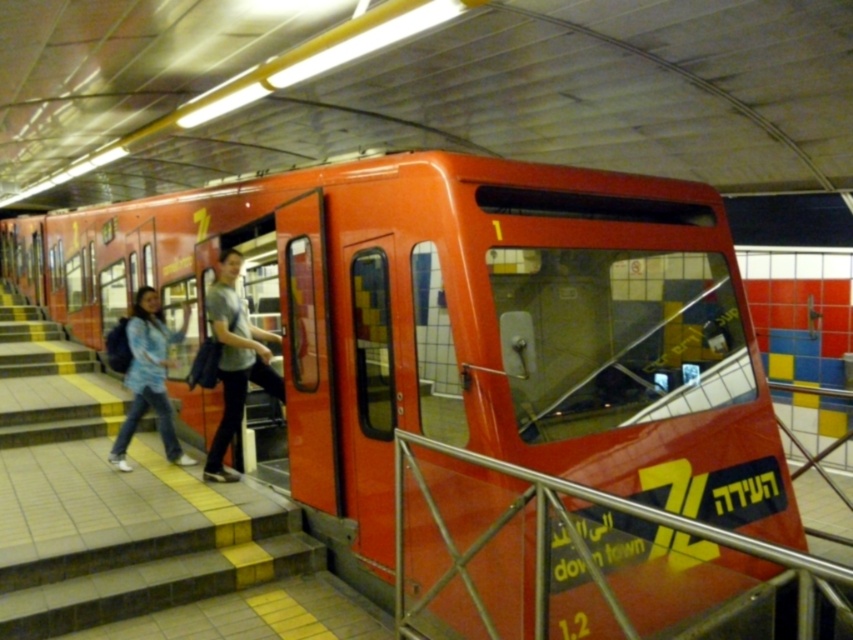
You are a passenger standing at the subway station platform. You need to grab the metallic silver rail at lower right to steady yourself while waiting for the train. Can you reach it from your current position near the blue denim jacket at left?

The metallic silver rail at lower right is larger in size than the blue denim jacket at left, but the question of reachability depends on distance, not size. Since the description only mentions size difference, there is insufficient information to determine if you can reach the rail from the jacket.

You are standing at the entrance of the subway station and want to board the metallic red train at center. Based on the platform layout described, which direction should you walk to reach the train?

The metallic red train at center is located at point coordinates, so you should walk towards the center of the platform to reach it.

You are a passenger waiting at the subway station. You see a metallic silver rail at lower right and a blue denim jacket at left. Which object is closer to the ground?

The metallic silver rail at lower right is located below the blue denim jacket at left, so it is closer to the ground.